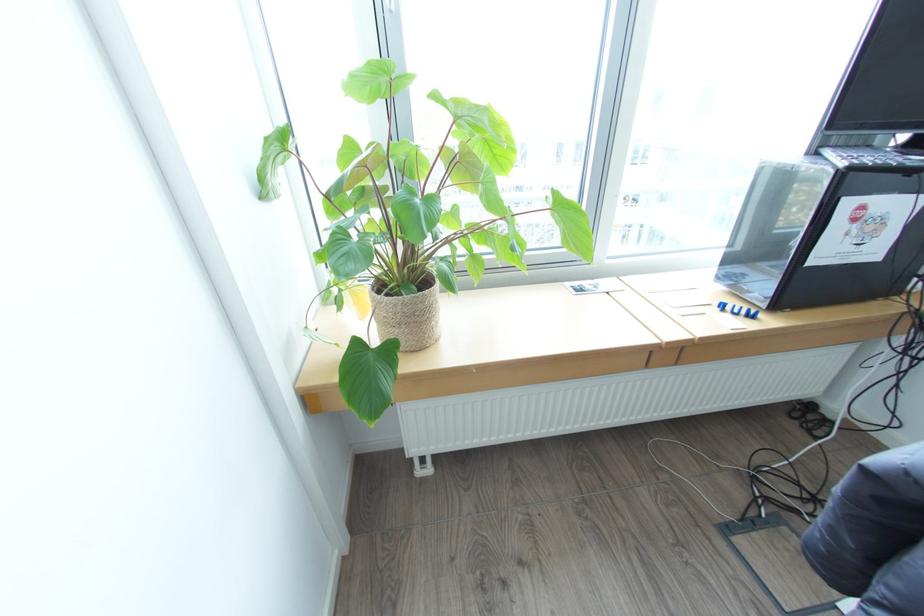
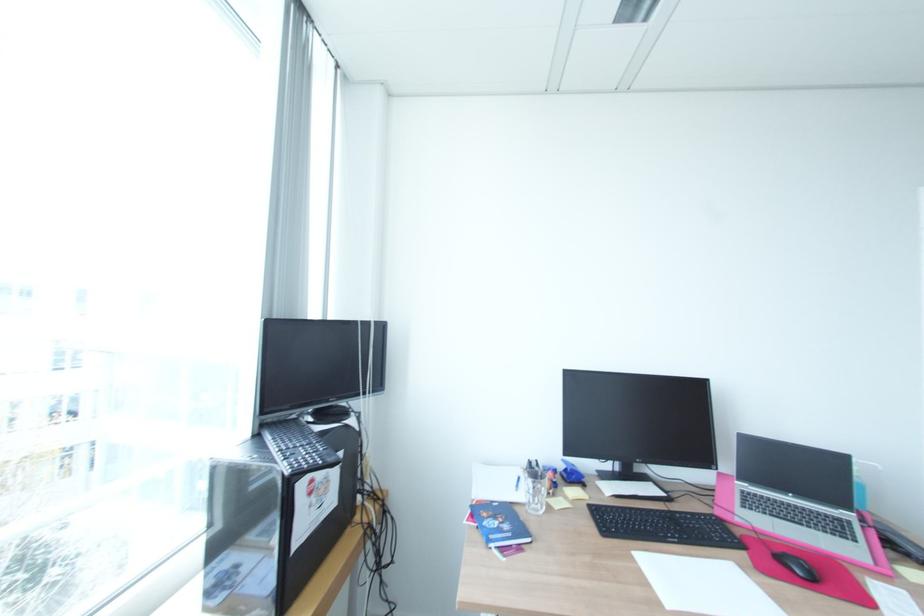
Find the pixel in the second image that matches point (817, 153) in the first image.

(262, 436)